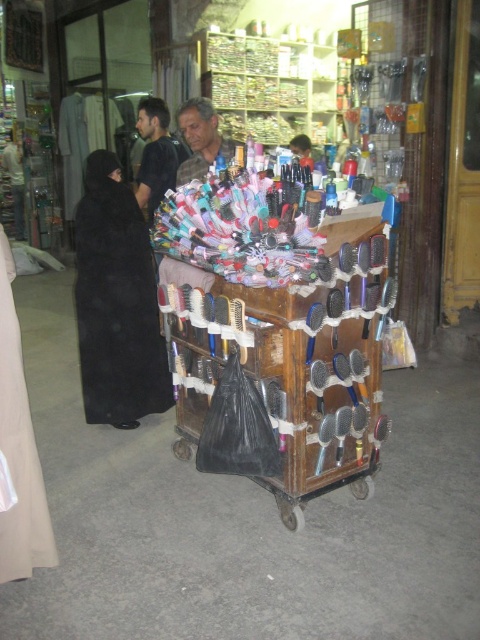
You are a customer at the market and want to buy a hairbrush. You see the wooden trolley at center and the dark brown hair at center. Which item is wider?

The wooden trolley at center is wider than the dark brown hair at center.

You are standing in front of the wooden cart in the market. There are two points marked on the cart. One is at coordinate point (140, 298) and the other is at point (160, 195). Which of these two points is closer to you?

Point (140, 298) is closer to the viewer than point (160, 195).

You are standing at the entrance of the market, which is located at point 0.5, 0.5. You want to approach the wooden trolley at center. In which direction should you move relative to your current position?

The wooden trolley at center is located at point (276, 332), which is slightly to the right and above your current position at (240, 320). Therefore, you should move diagonally towards the northeast direction to reach it.